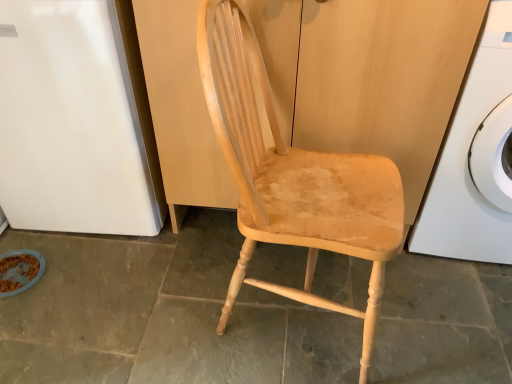
I want to click on blank space above brown crumbly food at lower left (from a real-world perspective), so click(15, 274).